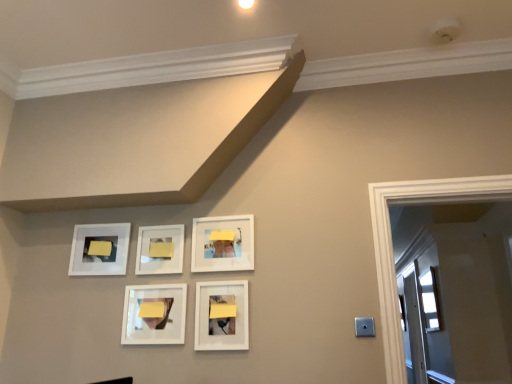
Question: From the image's perspective, is yellow matte post-it note at upper left, which appears as the second lift when viewed from the top, above or below yellow matte paper at center, the 2th lift viewed from the right?

Choices:
 (A) above
 (B) below

Answer: (B)

Question: Considering their positions, is yellow matte post-it note at upper left, the 1th lift when ordered from back to front, located in front of or behind yellow matte paper at center, arranged as the 3th lift when viewed from the front?

Choices:
 (A) front
 (B) behind

Answer: (B)

Question: Considering the real-world distances, which object is closest to the yellow matte post-it note at upper left, which is the 3th lift from bottom to top?

Choices:
 (A) yellow matte paper at center, arranged as the 3th lift when viewed from the front
 (B) matte white picture frame at lower center, which is counted as the first picture frame, starting from the right
 (C) white matte picture frame at center, acting as the 2th picture frame starting from the right
 (D) white glossy picture frame at upper left, arranged as the 5th picture frame when viewed from the right
 (E) yellow matte post-it note at lower center, which is the third lift in top-to-bottom order

Answer: (D)

Question: Which of these objects is positioned closest to the white glossy picture frame at center, which appears as the second picture frame when viewed from the left?

Choices:
 (A) matte white picture frame at lower center, arranged as the 5th picture frame when viewed from the left
 (B) yellow matte post-it note at lower center, the fourth lift viewed from the left
 (C) white matte picture frame at center, acting as the 2th picture frame starting from the right
 (D) yellow matte lift at lower center, positioned as the second lift in front-to-back order
 (E) white glossy picture frame at upper left, which is the 1th picture frame in left-to-right order

Answer: (D)